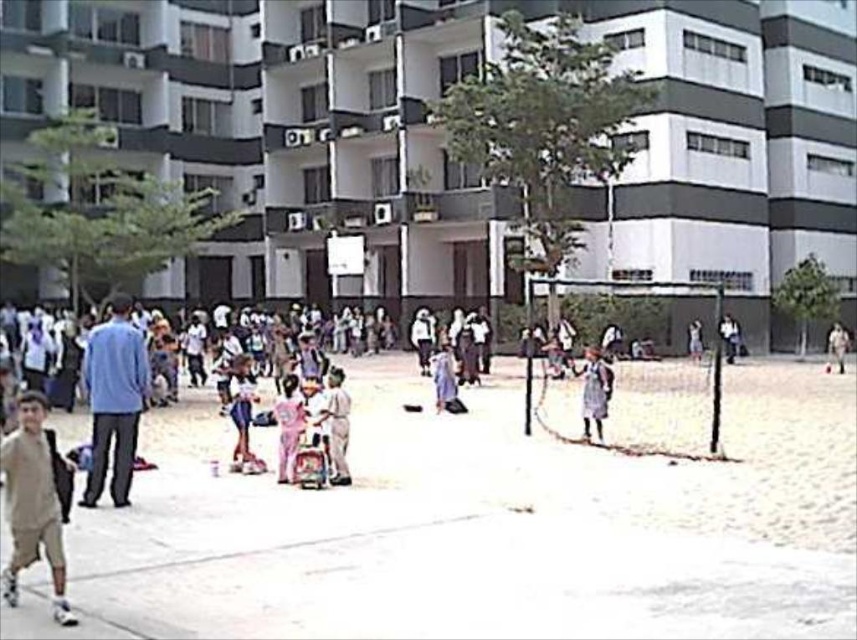
You are a photographer standing at the edge of the light gray concrete pavement at center and want to take a photo of the pink fabric dress at center. Which direction should you move to get the best shot?

The light gray concrete pavement at center is positioned on the right side of the pink fabric dress at center, so you should move to the left to get a better angle for the photo.

You are a photographer trying to capture a photo of the blue cotton shirt at left and the light pink fabric dress at center. Based on their positions, which one is higher in the image?

The blue cotton shirt at left is above the light pink fabric dress at center, so it is higher in the image.